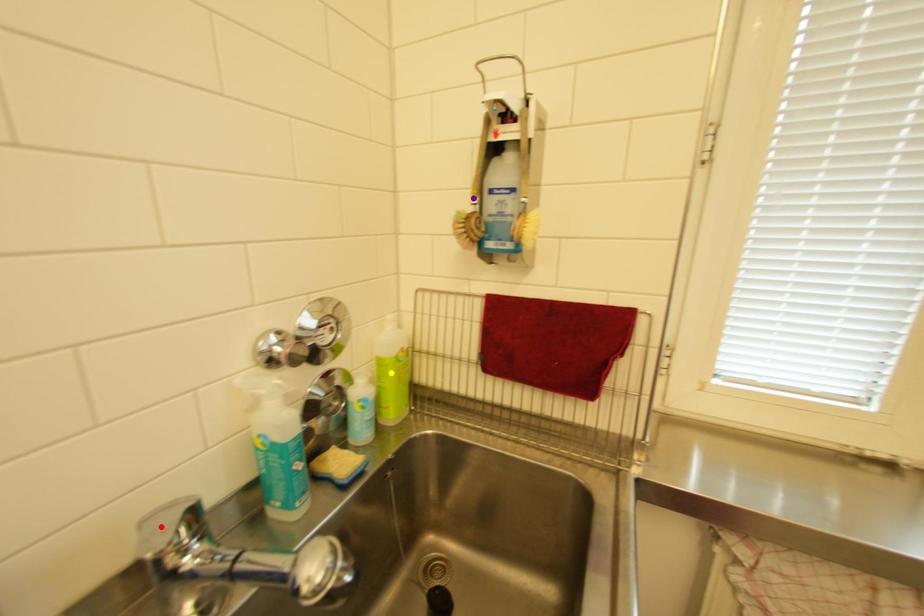
Order these from nearest to farthest:
1. purple point
2. yellow point
3. red point

red point
purple point
yellow point